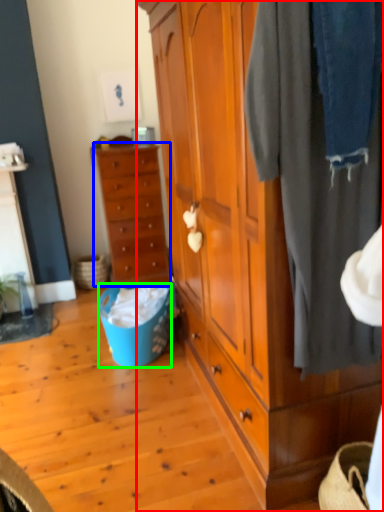
Question: Based on their relative distances, which object is farther from cabinetry (highlighted by a red box)? Choose from chest of drawers (highlighted by a blue box) and picnic basket (highlighted by a green box).

Choices:
 (A) chest of drawers
 (B) picnic basket

Answer: (A)